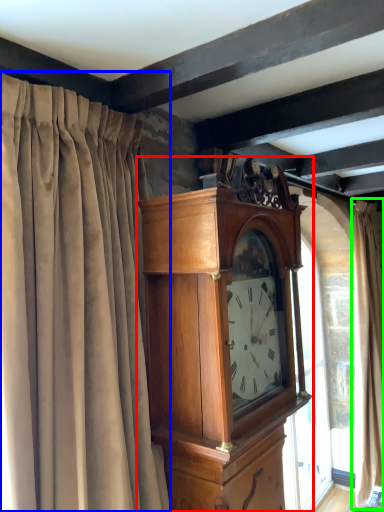
Question: Which object is the farthest from wall clock (highlighted by a red box)? Choose among these: curtain (highlighted by a blue box) or curtain (highlighted by a green box).

Choices:
 (A) curtain
 (B) curtain

Answer: (B)